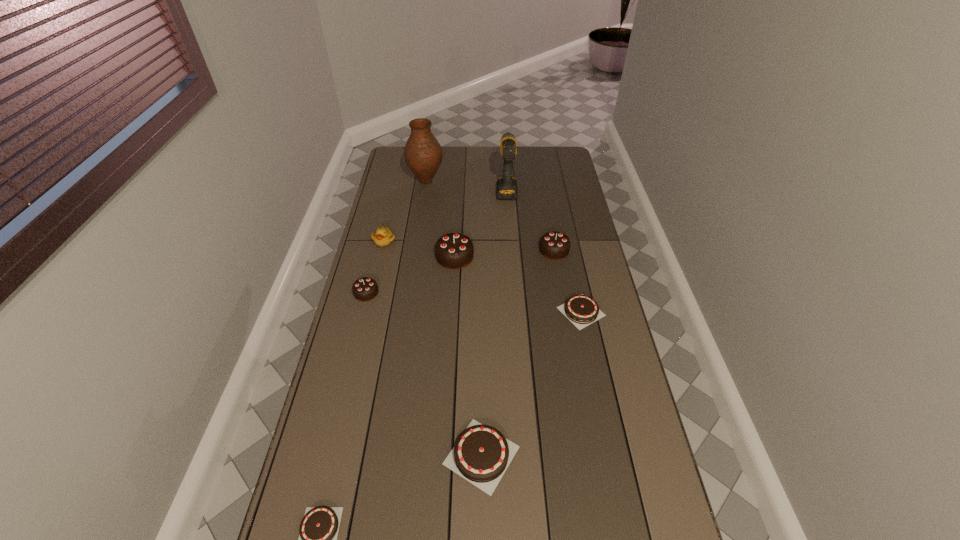
Locate which chocolate chocolate cake ranks third in proximity to the shortest object. Please provide its 2D coordinates. Your answer should be formatted as a tuple, i.e. [(x, y)], where the tuple contains the x and y coordinates of a point satisfying the conditions above.

[(554, 245)]

Locate which brown chocolate cake is the second closest to the fifth farthest chocolate cake. Please provide its 2D coordinates. Your answer should be formatted as a tuple, i.e. [(x, y)], where the tuple contains the x and y coordinates of a point satisfying the conditions above.

[(581, 310)]

Choose which brown chocolate cake is the second nearest neighbor to the vase. Please provide its 2D coordinates. Your answer should be formatted as a tuple, i.e. [(x, y)], where the tuple contains the x and y coordinates of a point satisfying the conditions above.

[(481, 455)]

This screenshot has height=540, width=960. Identify the location of vacant position in the image that satisfies the following two spatial constraints: 1. on the front side of the second brown chocolate cake from left to right; 2. on the right side of the nearest chocolate chocolate cake. (325, 455).

Image resolution: width=960 pixels, height=540 pixels. I want to click on vacant position in the image that satisfies the following two spatial constraints: 1. on the front-facing side of the seventh tallest object; 2. on the left side of the yellow duckling, so click(333, 455).